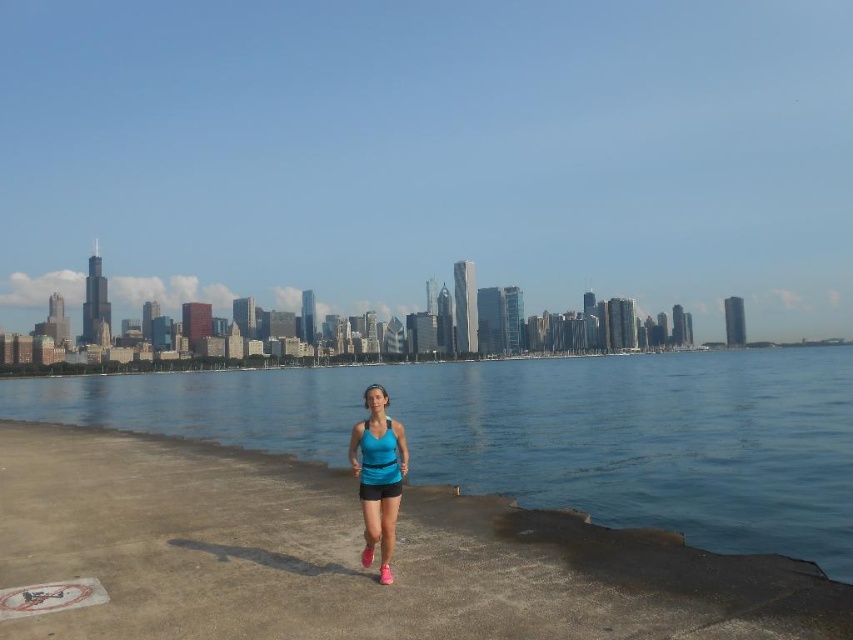
You are a photographer trying to capture the skyline in the background while including both the blue water at center and the blue fabric tank top at center in your shot. Which object will appear larger in the photo?

The blue water at center appears larger in the photo because it is taller than the blue fabric tank top at center.

In the scene shown: You are a photographer trying to capture the entire scene of the blue water at center and the blue fabric tank top at center in one shot. Based on their sizes, which one would appear more prominent in the photo?

The blue water at center appears more prominent in the photo because it has a larger size compared to the blue fabric tank top at center.

You are standing at the point marked by coordinates point (x=546, y=433). What is the color of the water directly beneath your feet?

The blue water at center is represented by point (x=546, y=433), so the water directly beneath your feet is blue.